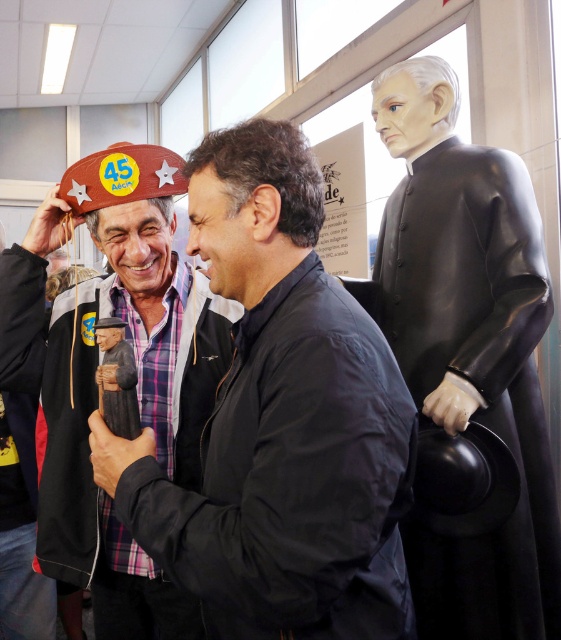
Who is positioned more to the right, black glossy statue at right or brown leather hat at upper left?

black glossy statue at right

Can you confirm if black glossy statue at right is positioned to the right of brown leather hat at upper left?

Yes, black glossy statue at right is to the right of brown leather hat at upper left.

Who is more forward, (394, 134) or (38, 301)?

Point (38, 301) is more forward.

Find the location of `black glossy statue at right`. black glossy statue at right is located at coordinates (467, 365).

Is point (204, 230) more distant than point (507, 380)?

No.

You are a GUI agent. You are given a task and a screenshot of the screen. Output one action in this format:
    pyautogui.click(x=<x>, y=<y>)
    Task: Click on the matte brown hat at left
    The image size is (561, 640).
    Given the screenshot: What is the action you would take?
    pyautogui.click(x=279, y=420)

Which of these two, matte brown hat at left or brown leather hat at upper left, stands shorter?

With less height is matte brown hat at left.

Between point (319, 193) and point (76, 310), which one is positioned behind?

Positioned behind is point (76, 310).

Find the location of a particular element. The width and height of the screenshot is (561, 640). matte brown hat at left is located at coordinates (279, 420).